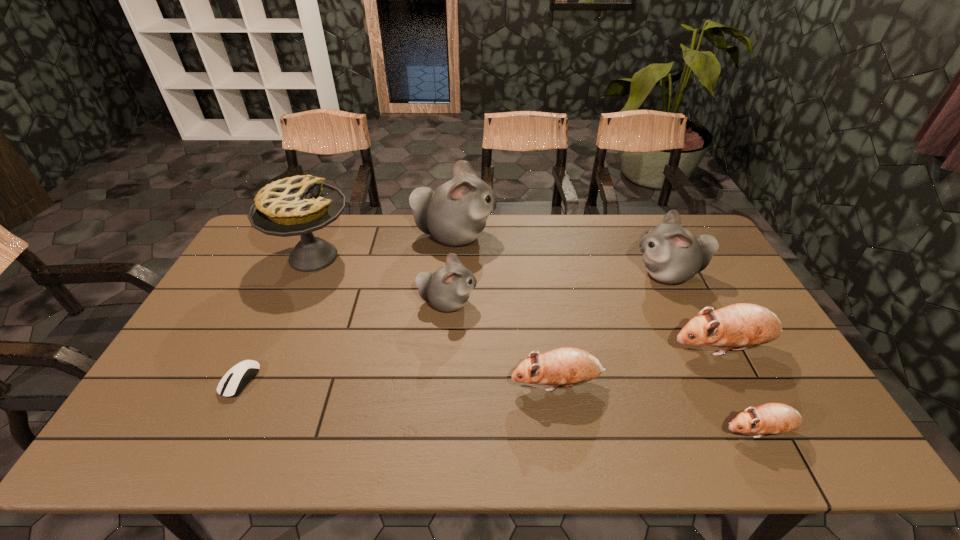
Where is `the farthest hamster`? The width and height of the screenshot is (960, 540). the farthest hamster is located at coordinates (455, 213).

Image resolution: width=960 pixels, height=540 pixels. I want to click on the tallest hamster, so click(455, 213).

Identify the location of pie. The height and width of the screenshot is (540, 960). (299, 205).

Identify the location of the rightmost white hamster. Image resolution: width=960 pixels, height=540 pixels. (672, 255).

Identify the location of the third tallest object. (672, 255).

Locate an element on the screen. The width and height of the screenshot is (960, 540). the smallest white hamster is located at coordinates click(x=447, y=289).

At what (x,y) coordinates should I click in order to perform the action: click on the biggest brown hamster. Please return your answer as a coordinate pair (x, y). Looking at the image, I should click on [x=740, y=326].

Find the location of a particular element. Image resolution: width=960 pixels, height=540 pixels. the farthest brown hamster is located at coordinates (740, 326).

Locate an element on the screen. the second nearest brown hamster is located at coordinates (567, 366).

Where is `the second nearest hamster`? The width and height of the screenshot is (960, 540). the second nearest hamster is located at coordinates (567, 366).